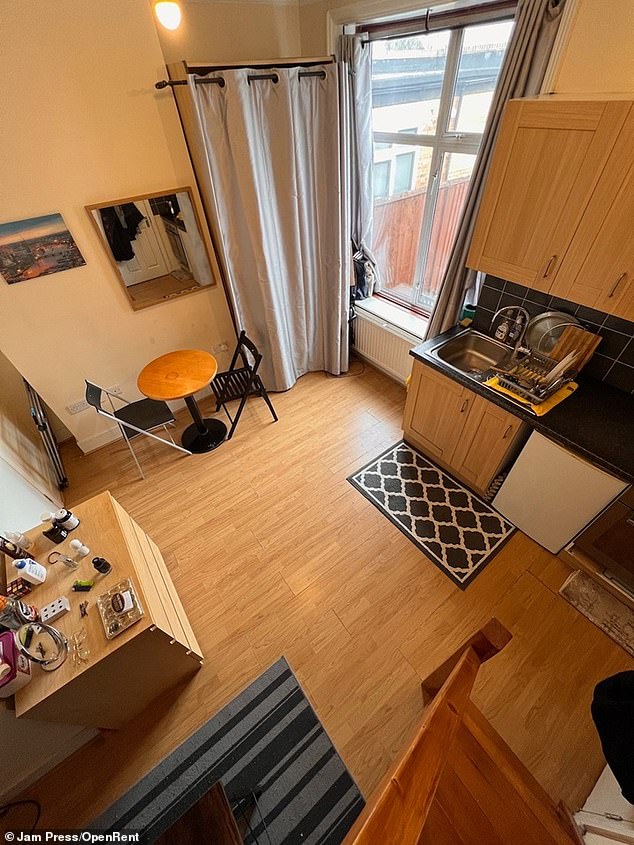
Identify the location of sink. (463, 358).